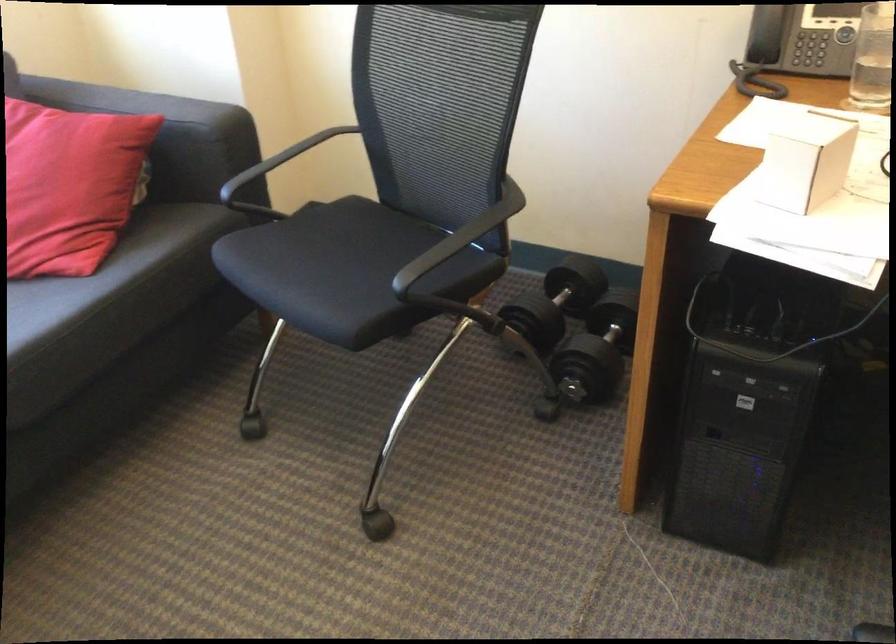
Image resolution: width=896 pixels, height=644 pixels. What do you see at coordinates (460, 238) in the screenshot? I see `a black chair armrest` at bounding box center [460, 238].